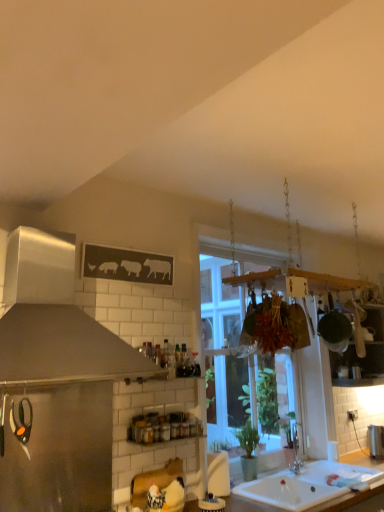
Question: Is brushed metal trash can at lower right, acting as the 3th appliance starting from the left, bigger than matte black scissors at left, which ranks as the first appliance in left-to-right order?

Choices:
 (A) yes
 (B) no

Answer: (A)

Question: From the image's perspective, is brushed metal trash can at lower right, positioned as the 3th appliance in front-to-back order, located beneath matte black scissors at left, which ranks as the 3th appliance in bottom-to-top order?

Choices:
 (A) no
 (B) yes

Answer: (B)

Question: Is brushed metal trash can at lower right, arranged as the 1th appliance when viewed from the back, with matte black scissors at left, the 1th appliance positioned from the top?

Choices:
 (A) no
 (B) yes

Answer: (A)

Question: Is brushed metal trash can at lower right, acting as the 3th appliance starting from the left, smaller than matte black scissors at left, which ranks as the third appliance in right-to-left order?

Choices:
 (A) no
 (B) yes

Answer: (A)

Question: Is brushed metal trash can at lower right, positioned as the 3th appliance in front-to-back order, positioned with its back to matte black scissors at left, the 1th appliance positioned from the top?

Choices:
 (A) yes
 (B) no

Answer: (B)

Question: Is brushed metal trash can at lower right, which is the 1th appliance from right to left, bigger or smaller than clear glass window at center?

Choices:
 (A) big
 (B) small

Answer: (B)

Question: From the image's perspective, is brushed metal trash can at lower right, acting as the 3th appliance starting from the left, positioned above or below clear glass window at center?

Choices:
 (A) below
 (B) above

Answer: (A)

Question: Do you think brushed metal trash can at lower right, positioned as the 3th appliance in front-to-back order, is within clear glass window at center, or outside of it?

Choices:
 (A) outside
 (B) inside

Answer: (A)

Question: From a real-world perspective, is brushed metal trash can at lower right, which is the 1th appliance from right to left, physically located above or below clear glass window at center?

Choices:
 (A) below
 (B) above

Answer: (A)

Question: From their relative heights in the image, would you say white glossy countertop at lower center is taller or shorter than brushed metal trash can at lower right, acting as the 3th appliance starting from the left?

Choices:
 (A) tall
 (B) short

Answer: (A)

Question: Is white glossy countertop at lower center inside the boundaries of brushed metal trash can at lower right, positioned as the 3th appliance in front-to-back order, or outside?

Choices:
 (A) outside
 (B) inside

Answer: (A)

Question: Would you say white glossy countertop at lower center is to the left or to the right of brushed metal trash can at lower right, positioned as the 3th appliance in top-to-bottom order, in the picture?

Choices:
 (A) right
 (B) left

Answer: (B)

Question: Is white glossy countertop at lower center wider or thinner than brushed metal trash can at lower right, arranged as the 1th appliance when viewed from the back?

Choices:
 (A) thin
 (B) wide

Answer: (B)

Question: From their relative heights in the image, would you say clear glass window at center is taller or shorter than brushed metal trash can at lower right, positioned as the 3th appliance in top-to-bottom order?

Choices:
 (A) tall
 (B) short

Answer: (A)

Question: From the image's perspective, is clear glass window at center located above or below brushed metal trash can at lower right, which is the 1th appliance from right to left?

Choices:
 (A) above
 (B) below

Answer: (A)